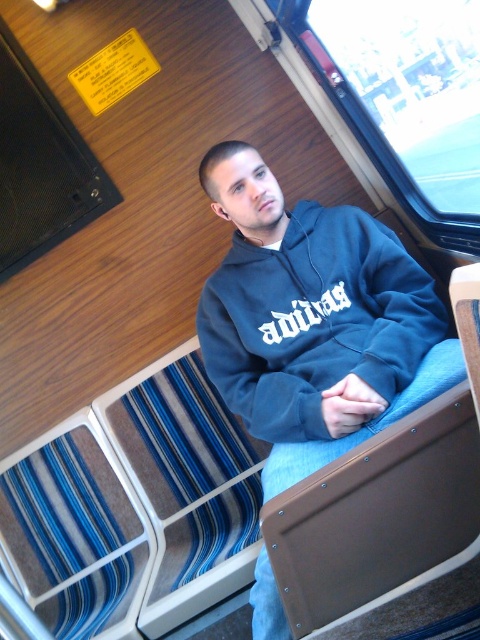
Is the position of dark blue hoodie at center less distant than that of dark blue fleece sweatshirt at center?

Yes, dark blue hoodie at center is in front of dark blue fleece sweatshirt at center.

Which is behind, point (359, 420) or point (210, 344)?

Point (210, 344)

Identify the location of dark blue hoodie at center. point(314,321).